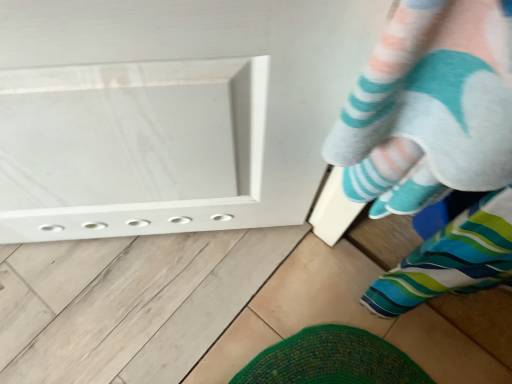
Question: Does point (313, 337) appear closer or farther from the camera than point (434, 16)?

Choices:
 (A) farther
 (B) closer

Answer: (A)

Question: Is striped fabric sock at lower right to the left or to the right of striped socks at lower right in the image?

Choices:
 (A) left
 (B) right

Answer: (B)

Question: Is striped fabric sock at lower right wider or thinner than striped socks at lower right?

Choices:
 (A) thin
 (B) wide

Answer: (B)

Question: Visually, is striped socks at lower right positioned to the left or to the right of striped fabric sock at lower right?

Choices:
 (A) left
 (B) right

Answer: (A)

Question: Would you say striped socks at lower right is inside or outside striped fabric sock at lower right?

Choices:
 (A) inside
 (B) outside

Answer: (B)

Question: Looking at the image, does striped socks at lower right seem bigger or smaller compared to striped fabric sock at lower right?

Choices:
 (A) big
 (B) small

Answer: (A)

Question: Is striped socks at lower right in front of or behind striped fabric sock at lower right in the image?

Choices:
 (A) behind
 (B) front

Answer: (B)